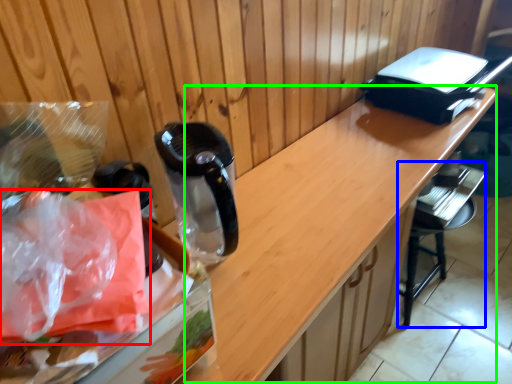
Question: Which is farther away from plastic bag (highlighted by a red box)? bar stool (highlighted by a blue box) or counter (highlighted by a green box)?

Choices:
 (A) bar stool
 (B) counter

Answer: (A)